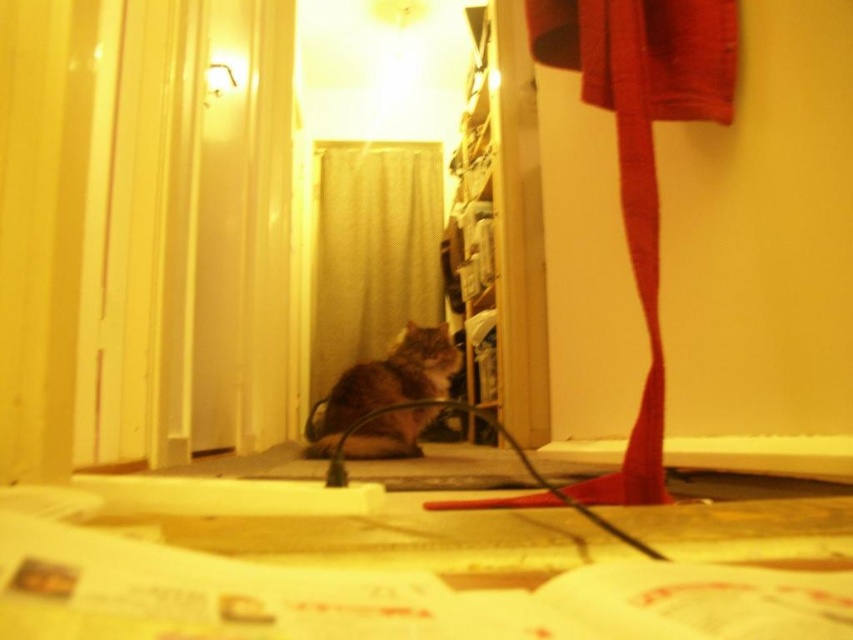
Is white textured curtain at center wider than tabby fur cat at center?

Indeed, white textured curtain at center has a greater width compared to tabby fur cat at center.

Does point (442, 198) come behind point (374, 428)?

Yes, it is.

Is point (373, 154) positioned in front of point (415, 410)?

No, it is behind (415, 410).

What are the coordinates of `white textured curtain at center` in the screenshot? It's located at (373, 250).